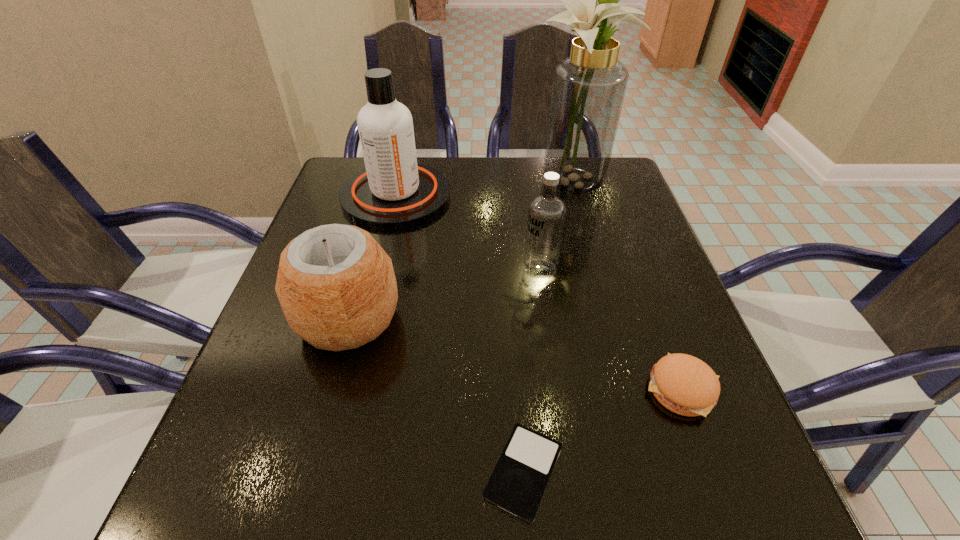
Image resolution: width=960 pixels, height=540 pixels. Identify the location of flower arrangement that is positioned at the right edge. (588, 89).

Identify the location of patty positioned at the right edge. (684, 384).

Find the location of a particular element. Image resolution: width=960 pixels, height=540 pixels. object that is at the far left corner is located at coordinates (394, 191).

At what (x,y) coordinates should I click in order to perform the action: click on object at the far right corner. Please return your answer as a coordinate pair (x, y). The width and height of the screenshot is (960, 540). Looking at the image, I should click on (588, 89).

Locate an element on the screen. Image resolution: width=960 pixels, height=540 pixels. vacant position at the far edge of the desktop is located at coordinates (540, 180).

The image size is (960, 540). Identify the location of vacant space at the left edge of the desktop. (331, 217).

Find the location of a particular element. This screenshot has width=960, height=540. free region at the right edge is located at coordinates (594, 211).

At what (x,y) coordinates should I click in order to perform the action: click on free space at the far left corner of the desktop. Please return your answer as a coordinate pair (x, y). This screenshot has width=960, height=540. Looking at the image, I should click on (335, 183).

The width and height of the screenshot is (960, 540). Identify the location of free space at the far right corner. (598, 204).

Locate an element on the screen. vacant area that lies between the iPod and the coconut is located at coordinates (436, 395).